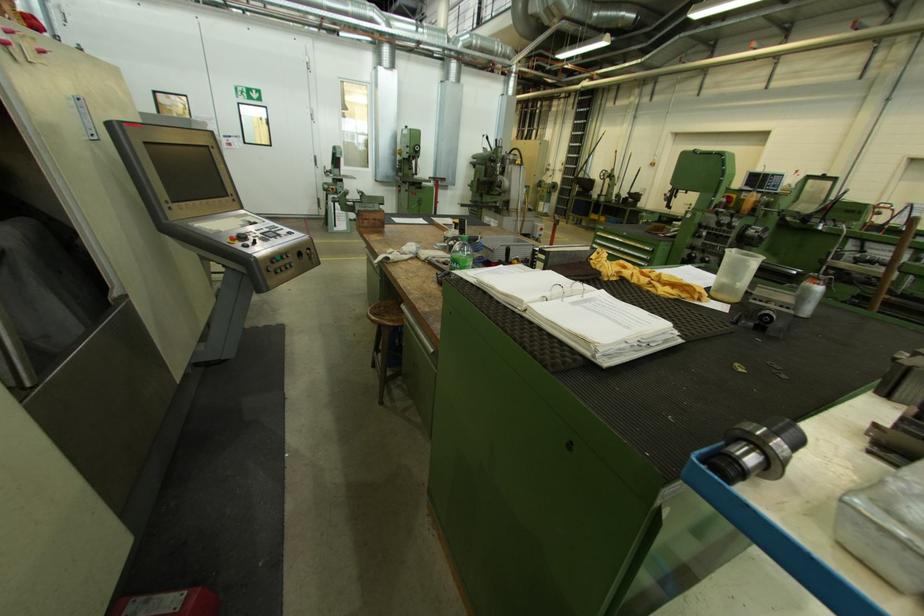
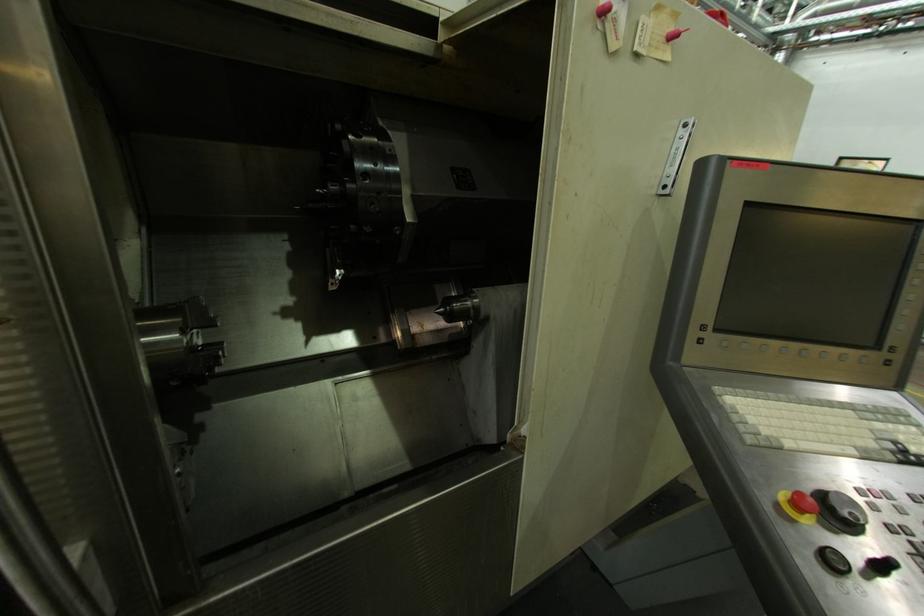
The point at (44, 49) is marked in the first image. Where is the corresponding point in the second image?

(677, 30)